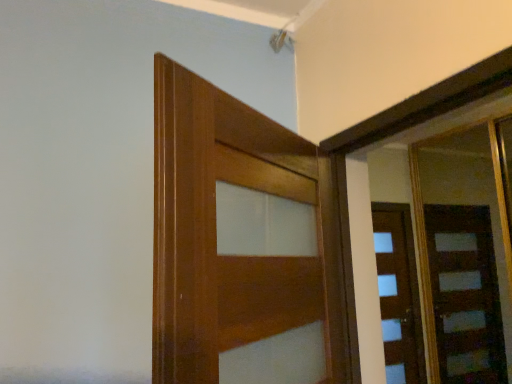
Question: Is wooden door at right, acting as the 1th door starting from the right, shorter than wooden door at center, the 1th door positioned from the front?

Choices:
 (A) no
 (B) yes

Answer: (A)

Question: Are wooden door at right, acting as the 1th door starting from the right, and wooden door at center, marked as the first door in a left-to-right arrangement, far apart?

Choices:
 (A) yes
 (B) no

Answer: (A)

Question: Considering the relative sizes of wooden door at right, which ranks as the second door in front-to-back order, and wooden door at center, placed as the 2th door when sorted from right to left, in the image provided, is wooden door at right, which ranks as the second door in front-to-back order, bigger than wooden door at center, placed as the 2th door when sorted from right to left,?

Choices:
 (A) yes
 (B) no

Answer: (A)

Question: Is wooden door at right, which is the 1th door in back-to-front order, to the left of wooden door at center, the 1th door positioned from the front, from the viewer's perspective?

Choices:
 (A) yes
 (B) no

Answer: (B)

Question: Does wooden door at right, the 2th door when ordered from left to right, have a greater height compared to wooden door at center, the second door positioned from the back?

Choices:
 (A) no
 (B) yes

Answer: (B)

Question: From the image's perspective, would you say wooden door at right, the 2th door when ordered from left to right, is positioned over wooden door at center, placed as the 2th door when sorted from right to left?

Choices:
 (A) no
 (B) yes

Answer: (A)

Question: From the image's perspective, is wooden door at center, placed as the 2th door when sorted from right to left, located beneath wooden door at right, acting as the 1th door starting from the right?

Choices:
 (A) no
 (B) yes

Answer: (A)

Question: Is wooden door at center, placed as the 2th door when sorted from right to left, not within wooden door at right, which is the 1th door in back-to-front order?

Choices:
 (A) no
 (B) yes

Answer: (B)

Question: Can you confirm if wooden door at center, placed as the 2th door when sorted from right to left, is positioned to the right of wooden door at right, the 2th door when ordered from left to right?

Choices:
 (A) no
 (B) yes

Answer: (A)

Question: Does wooden door at center, marked as the first door in a left-to-right arrangement, have a lesser width compared to wooden door at right, acting as the 1th door starting from the right?

Choices:
 (A) no
 (B) yes

Answer: (A)

Question: Is wooden door at center, marked as the first door in a left-to-right arrangement, positioned far away from wooden door at right, acting as the 1th door starting from the right?

Choices:
 (A) yes
 (B) no

Answer: (A)

Question: From a real-world perspective, is wooden door at center, the 1th door positioned from the front, positioned under wooden door at right, which is the 1th door in back-to-front order, based on gravity?

Choices:
 (A) no
 (B) yes

Answer: (B)

Question: Looking at their shapes, would you say wooden door at center, the second door positioned from the back, is wider or thinner than wooden door at right, which ranks as the second door in front-to-back order?

Choices:
 (A) thin
 (B) wide

Answer: (B)